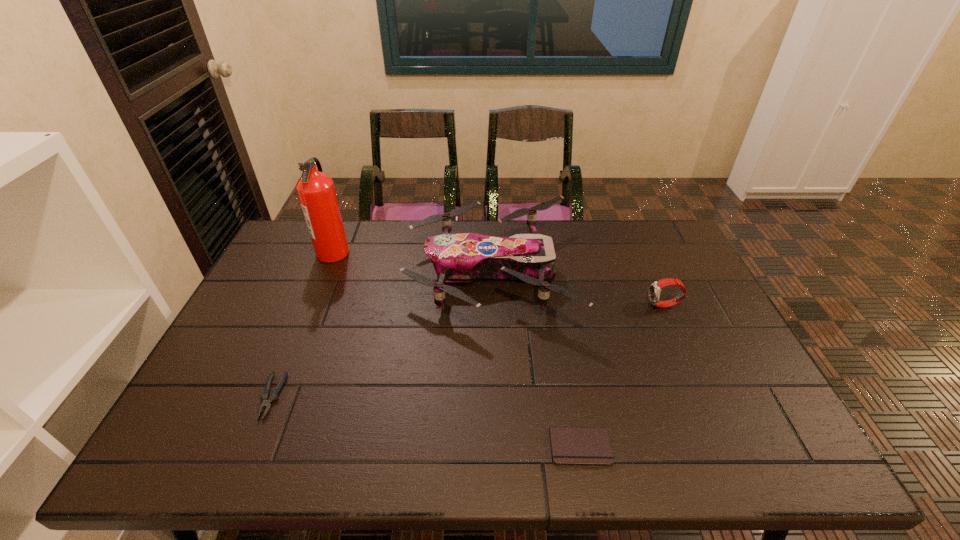
Identify the location of vacant point that satisfies the following two spatial constraints: 1. on the front-facing side of the drone; 2. on the right side of the shortest object. The height and width of the screenshot is (540, 960). (493, 447).

At what (x,y) coordinates should I click in order to perform the action: click on free space that satisfies the following two spatial constraints: 1. at the nozzle of the tallest object; 2. at the gripping part of the second shortest object. Please return your answer as a coordinate pair (x, y). The height and width of the screenshot is (540, 960). Looking at the image, I should click on (275, 396).

This screenshot has width=960, height=540. Find the location of `vacant space that satisfies the following two spatial constraints: 1. on the front-facing side of the fourth shortest object; 2. at the gripping part of the pliers`. vacant space that satisfies the following two spatial constraints: 1. on the front-facing side of the fourth shortest object; 2. at the gripping part of the pliers is located at coordinates (492, 396).

Locate an element on the screen. blank area in the image that satisfies the following two spatial constraints: 1. at the nozzle of the tallest object; 2. at the gripping part of the pliers is located at coordinates (275, 396).

The width and height of the screenshot is (960, 540). I want to click on free spot that satisfies the following two spatial constraints: 1. at the gripping part of the pliers; 2. on the right side of the checkbook, so click(x=251, y=447).

What are the coordinates of `free space that satisfies the following two spatial constraints: 1. on the front-facing side of the drone; 2. on the left side of the shortest object` in the screenshot? It's located at (493, 447).

Where is `free region that satisfies the following two spatial constraints: 1. on the front-facing side of the second tallest object; 2. at the gripping part of the fourth tallest object`? The width and height of the screenshot is (960, 540). free region that satisfies the following two spatial constraints: 1. on the front-facing side of the second tallest object; 2. at the gripping part of the fourth tallest object is located at coordinates (492, 396).

What are the coordinates of `free space in the image that satisfies the following two spatial constraints: 1. on the face of the watch; 2. on the front side of the nearest object` in the screenshot? It's located at (727, 447).

Identify the location of free spot that satisfies the following two spatial constraints: 1. on the front-facing side of the drone; 2. at the gripping part of the second nearest object. (492, 396).

Identify the location of free space that satisfies the following two spatial constraints: 1. at the nozzle of the nearest object; 2. on the right side of the fire extinguisher. (254, 447).